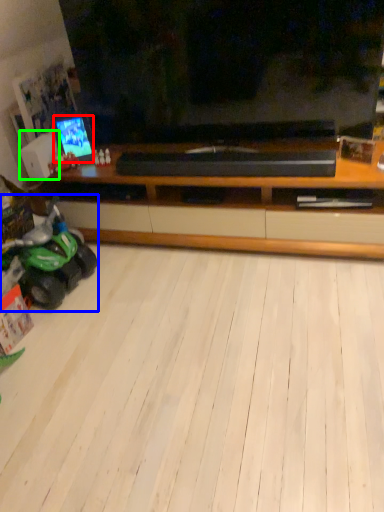
Question: Based on their relative distances, which object is farther from tv show (highlighted by a red box)? Choose from land vehicle (highlighted by a blue box) and speaker (highlighted by a green box).

Choices:
 (A) land vehicle
 (B) speaker

Answer: (A)